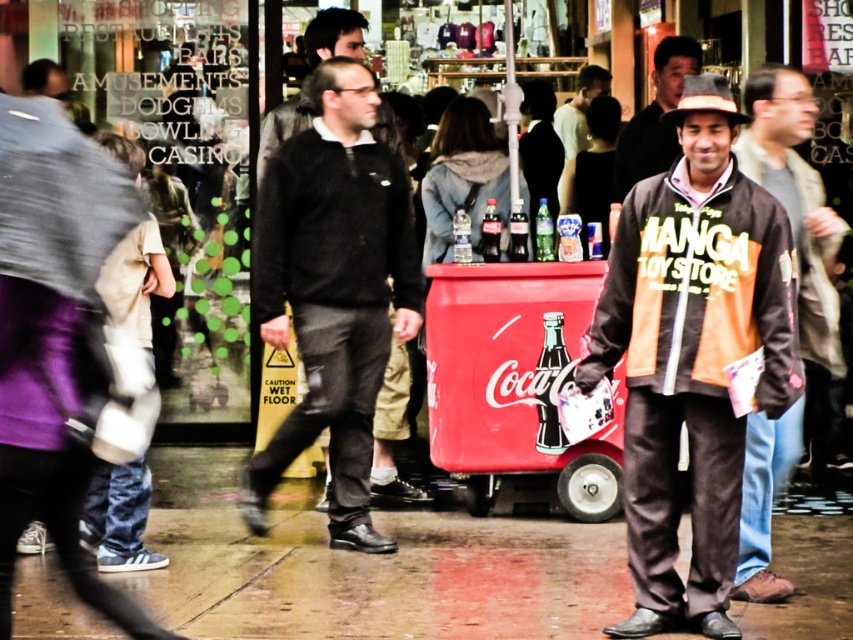
You are standing at the entrance of the Manga Toy Store. You see a black sweater at center and a red Coca Cola cart. Which one is closer to you?

The black sweater at center is closer to you because you are standing at the entrance of the Manga Toy Store, and the red Coca Cola cart is further away.

You are a fashion designer observing the scene. You notice the black sweater at center and the matte gray hat at upper right. Which item is smaller in size?

The black sweater at center has a smaller size compared to the matte gray hat at upper right.